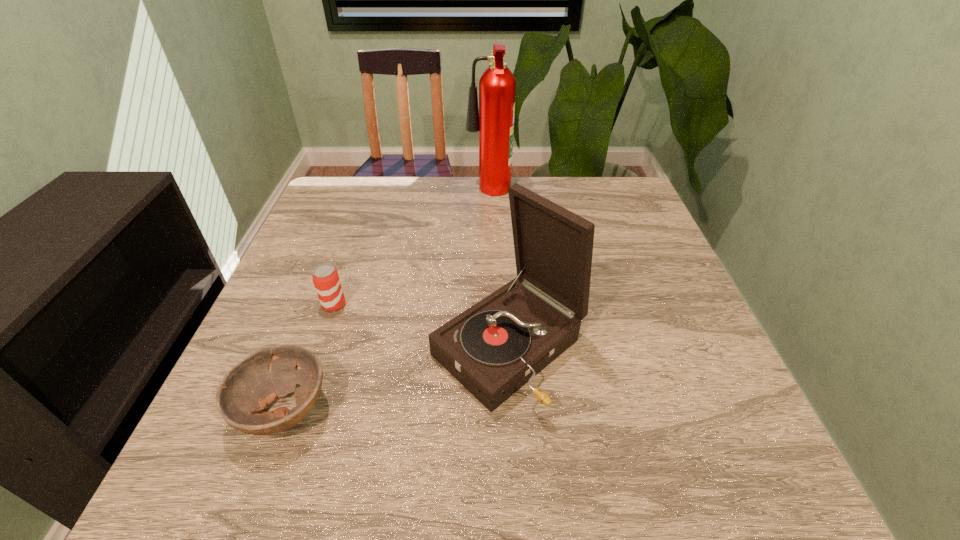
Find the location of `the tallest object`. the tallest object is located at coordinates (494, 119).

Find the location of `fire extinguisher`. fire extinguisher is located at coordinates (494, 119).

In order to click on phonograph record in this screenshot , I will do `click(495, 347)`.

Image resolution: width=960 pixels, height=540 pixels. I want to click on the second shortest object, so click(326, 280).

Where is `bowl`? The width and height of the screenshot is (960, 540). bowl is located at coordinates (253, 384).

Where is `vacant space positioned at the nozzle of the farthest object`? vacant space positioned at the nozzle of the farthest object is located at coordinates coord(399,193).

Find the location of a particular element. Image resolution: width=960 pixels, height=540 pixels. vacant space situated at the nozzle of the farthest object is located at coordinates (393, 193).

You are a GUI agent. You are given a task and a screenshot of the screen. Output one action in this format:
    pyautogui.click(x=<x>, y=<y>)
    Task: Click on the blank space located 0.130m at the nozzle of the farthest object
    This screenshot has width=960, height=540.
    Given the screenshot: What is the action you would take?
    pyautogui.click(x=422, y=193)

Where is `free space located on the left of the phonograph record`? This screenshot has width=960, height=540. free space located on the left of the phonograph record is located at coordinates (391, 349).

Locate an element on the screen. free space located 0.050m on the back of the beer can is located at coordinates (342, 281).